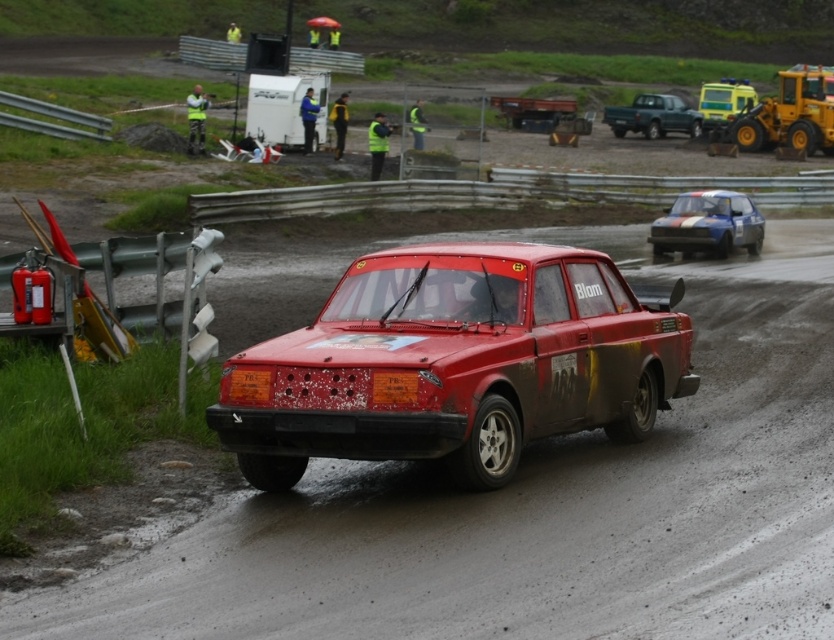
Is rusty metallic car at center above green matte pickup truck at upper right?

Incorrect, rusty metallic car at center is not positioned above green matte pickup truck at upper right.

Does point (294, 435) come behind point (647, 100)?

No, it is not.

This screenshot has height=640, width=834. Find the location of `rusty metallic car at center`. rusty metallic car at center is located at coordinates (455, 364).

Is point (747, 212) in front of point (654, 132)?

Yes.

Between point (707, 220) and point (616, 112), which one is positioned in front?

Positioned in front is point (707, 220).

Between point (702, 248) and point (656, 125), which one is positioned in front?

Point (702, 248)

Locate an element on the screen. The image size is (834, 640). blue metallic car at upper right is located at coordinates (707, 225).

Is rusty metallic car at center closer to camera compared to yellow reflective vest at upper left?

That is True.

How distant is rusty metallic car at center from yellow reflective vest at upper left?

rusty metallic car at center is 90.42 feet away from yellow reflective vest at upper left.

Between point (364, 307) and point (194, 136), which one is positioned in front?

Point (364, 307) is more forward.

You are a GUI agent. You are given a task and a screenshot of the screen. Output one action in this format:
    pyautogui.click(x=<x>, y=<y>)
    Task: Click on the rusty metallic car at center
    
    Given the screenshot: What is the action you would take?
    pyautogui.click(x=455, y=364)